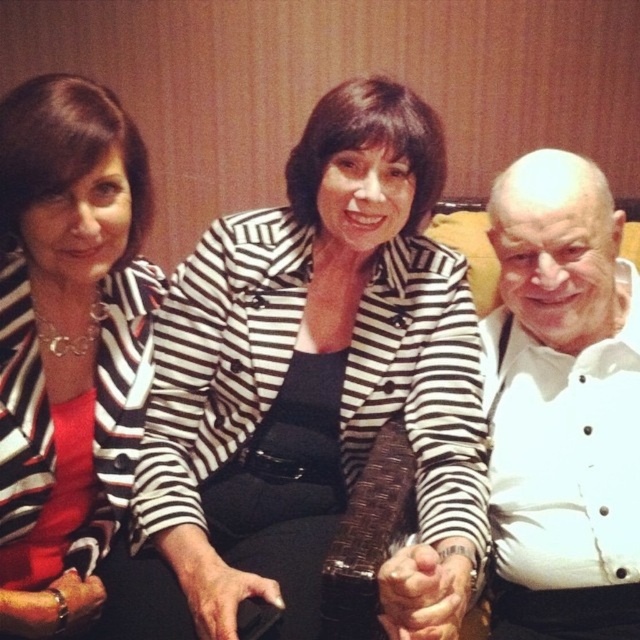
Is matte black blazer at upper left taller than white textured shirt at right?

Indeed, matte black blazer at upper left has a greater height compared to white textured shirt at right.

Is matte black blazer at upper left positioned behind white textured shirt at right?

No, it is in front of white textured shirt at right.

Between point (70, 104) and point (536, 394), which one is positioned in front?

Point (70, 104) is more forward.

Find the location of a particular element. matte black blazer at upper left is located at coordinates (67, 342).